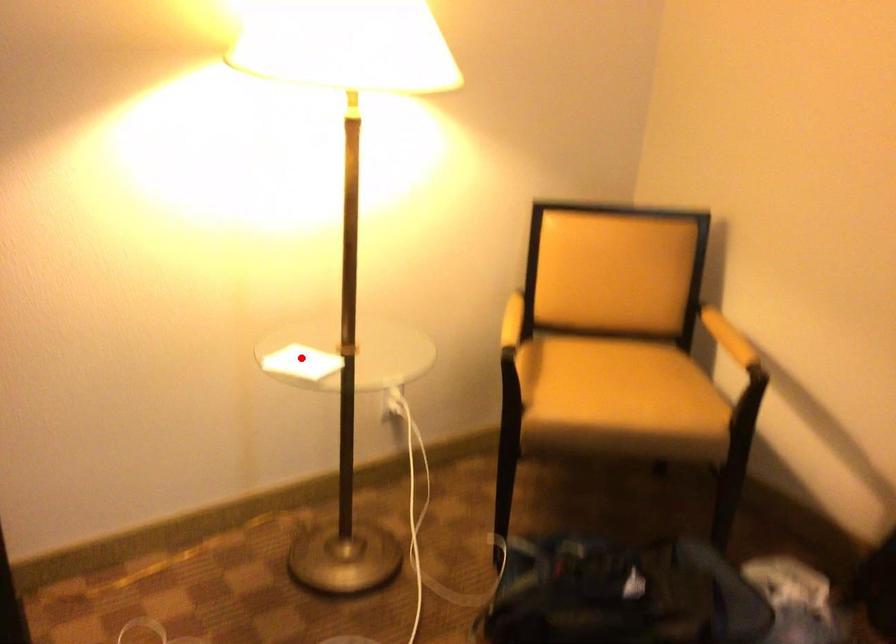
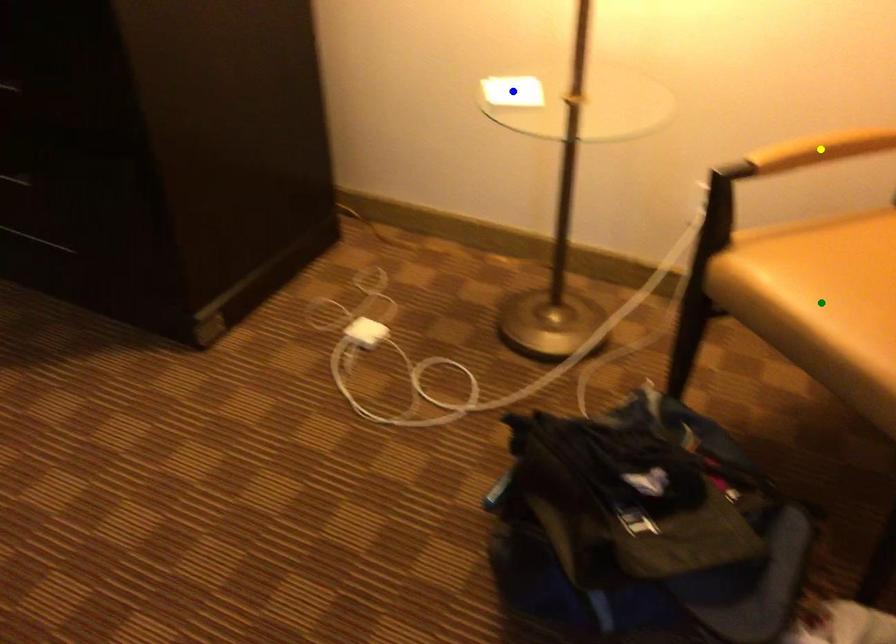
Question: I am providing you with two images of the same scene from different viewpoints. A red point is marked on the first image. You are given multiple points on the second image. Which point in image 2 represents the same 3d spot as the red point in image 1?

Choices:
 (A) green point
 (B) yellow point
 (C) blue point

Answer: (C)